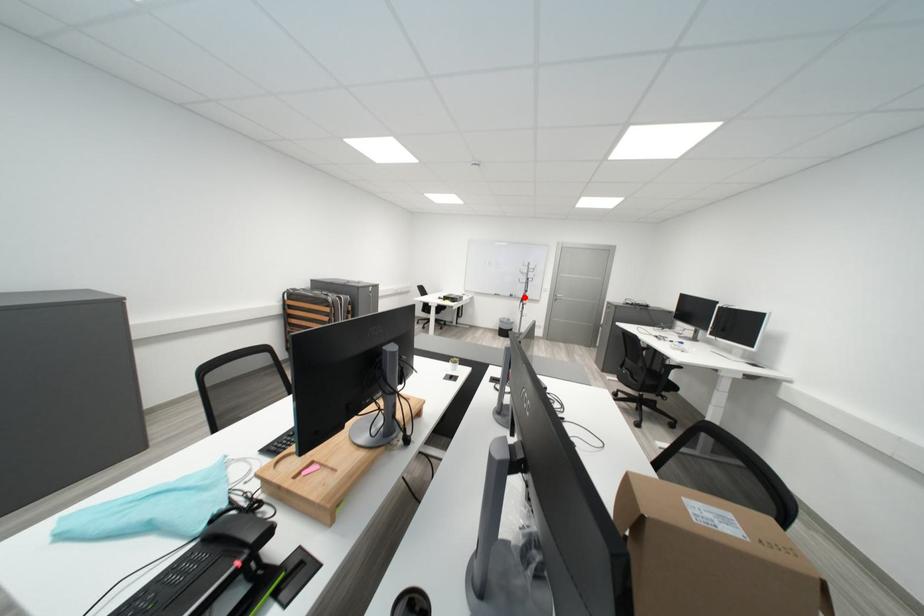
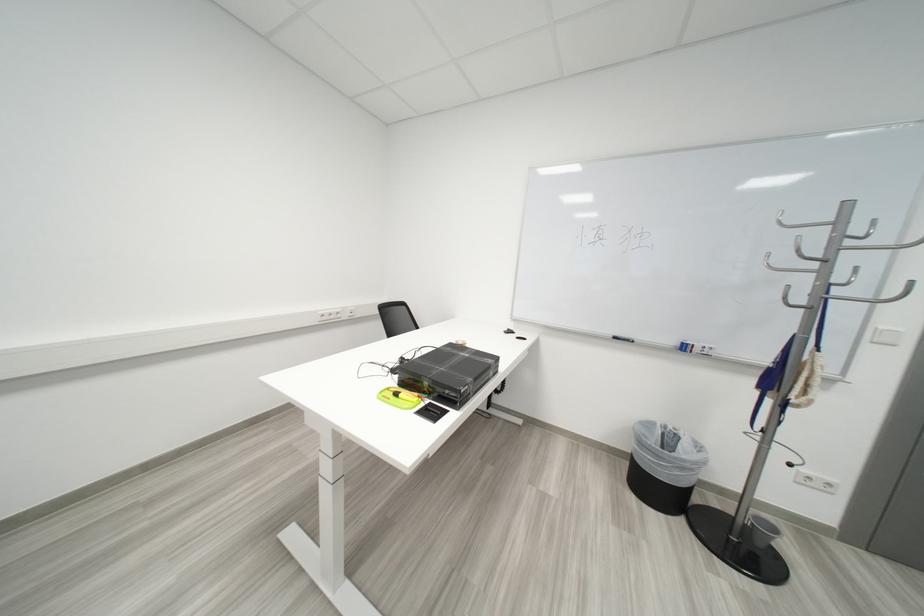
In the second image, find the point that corresponds to the highlighted location in the first image.

(698, 350)